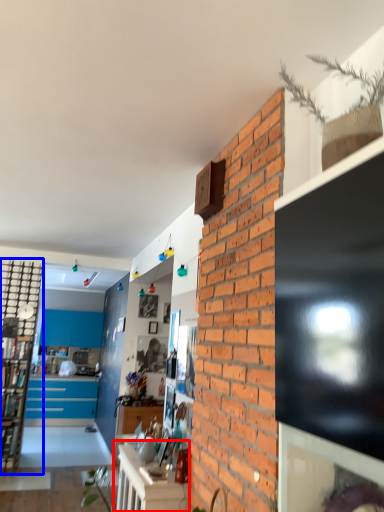
Question: Which of the following is the closest to the observer, table (highlighted by a red box) or cabinetry (highlighted by a blue box)?

Choices:
 (A) table
 (B) cabinetry

Answer: (A)